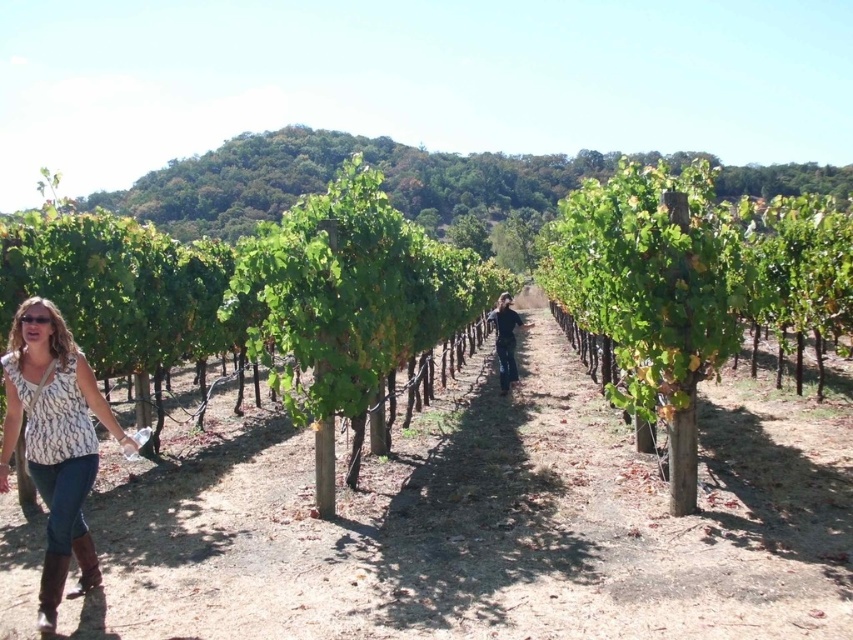
Question: Does white printed blouse at lower left appear on the left side of brown leather boot at lower left?

Choices:
 (A) yes
 (B) no

Answer: (A)

Question: Is white printed blouse at lower left closer to the viewer compared to brown suede boot at lower left?

Choices:
 (A) no
 (B) yes

Answer: (B)

Question: Is the position of white printed blouse at lower left more distant than that of brown suede boot at lower left?

Choices:
 (A) yes
 (B) no

Answer: (B)

Question: Which of the following is the farthest from the observer?

Choices:
 (A) (53, 362)
 (B) (47, 620)
 (C) (88, 564)

Answer: (C)

Question: Estimate the real-world distances between objects in this image. Which object is closer to the brown leather boot at lower left?

Choices:
 (A) white printed blouse at lower left
 (B) transparent plastic goggles at lower left
 (C) brown suede boot at lower left

Answer: (A)

Question: Which point is closer to the camera taking this photo?

Choices:
 (A) (76, 589)
 (B) (9, 376)
 (C) (49, 586)

Answer: (C)